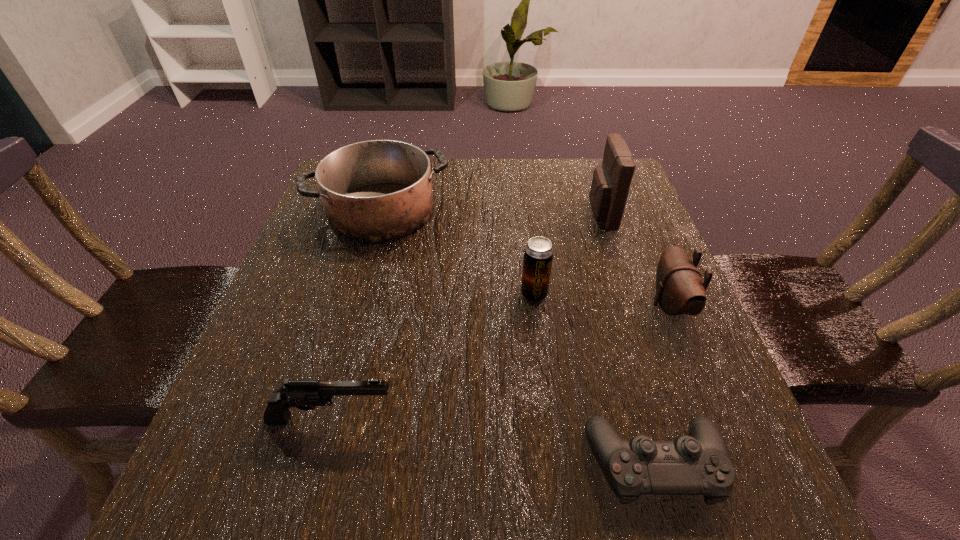
This screenshot has width=960, height=540. Identify the location of vacant space located 0.330m with an open flap on the left pouch. (449, 214).

At what (x,y) coordinates should I click in order to perform the action: click on vacant area situated on the front of the fourth object from right to left. Please return your answer as a coordinate pair (x, y). The height and width of the screenshot is (540, 960). Looking at the image, I should click on (561, 513).

Locate an element on the screen. free space located 0.290m on the right of the saucepan is located at coordinates (571, 211).

Where is `free space located with the flap open on the nearer pouch`? The width and height of the screenshot is (960, 540). free space located with the flap open on the nearer pouch is located at coordinates (626, 305).

Identify the location of vacant space positioned with the flap open on the nearer pouch. (442, 305).

This screenshot has width=960, height=540. Find the location of `vacant space located 0.160m with the flap open on the nearer pouch`. vacant space located 0.160m with the flap open on the nearer pouch is located at coordinates (568, 305).

The width and height of the screenshot is (960, 540). What are the coordinates of `free space located 0.240m at the end of the barrel of the gun` in the screenshot? It's located at (554, 419).

I want to click on free space located 0.290m on the back of the control, so click(605, 287).

Locate an element on the screen. pouch that is positioned at the far edge is located at coordinates (611, 181).

This screenshot has height=540, width=960. Identify the location of saucepan present at the far edge. (379, 190).